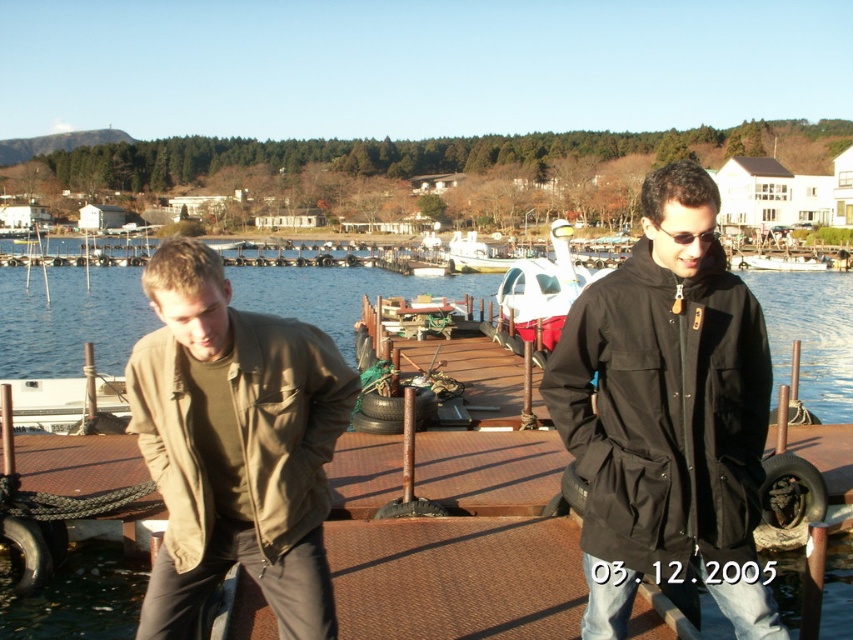
Who is taller, black cotton jacket at center or olive green fabric jacket at lower left?

black cotton jacket at center

Describe the element at coordinates (664, 412) in the screenshot. I see `black cotton jacket at center` at that location.

The image size is (853, 640). Describe the element at coordinates (664, 412) in the screenshot. I see `black cotton jacket at center` at that location.

I want to click on black cotton jacket at center, so click(x=664, y=412).

Which is below, black cotton jacket at center or white glossy pod at center?

black cotton jacket at center is lower down.

Does black cotton jacket at center appear over white glossy pod at center?

No.

Describe the element at coordinates (664, 412) in the screenshot. I see `black cotton jacket at center` at that location.

At what (x,y) coordinates should I click in order to perform the action: click on black cotton jacket at center. Please return your answer as a coordinate pair (x, y). Looking at the image, I should click on (664, 412).

Is olive green fabric jacket at lower left positioned behind white glossy pod at center?

No.

Does point (286, 346) come closer to viewer compared to point (538, 260)?

That is True.

Locate an element on the screen. This screenshot has height=640, width=853. olive green fabric jacket at lower left is located at coordinates (286, 420).